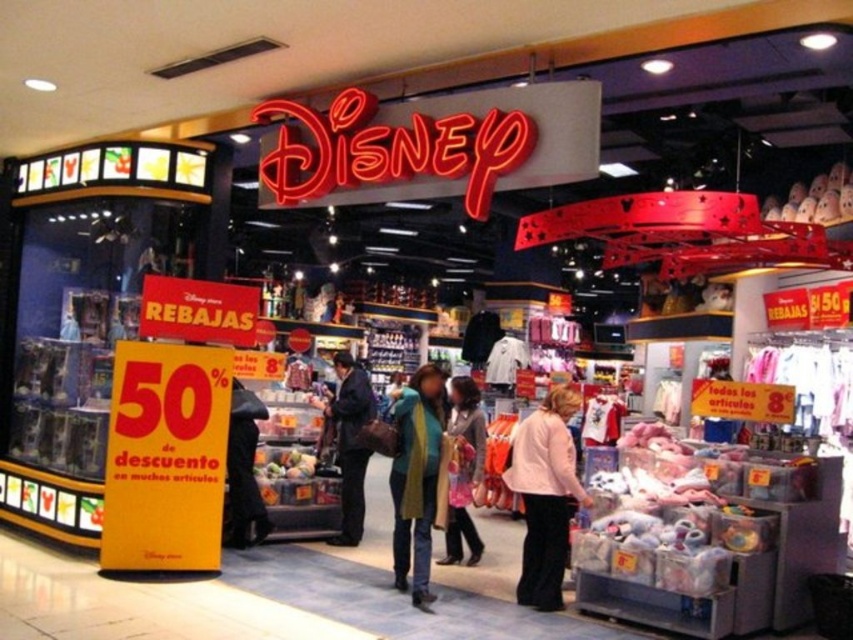
You are a customer in the Disney store and want to pick up both the pink fabric jacket at lower center and the green knitted scarf at center. How far apart are these items?

The pink fabric jacket at lower center is 30.50 inches from the green knitted scarf at center.